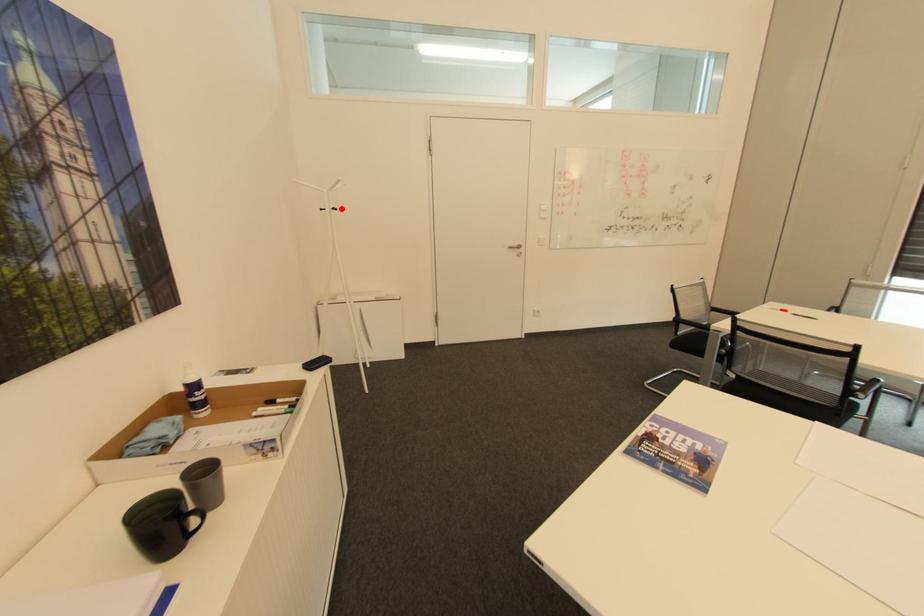
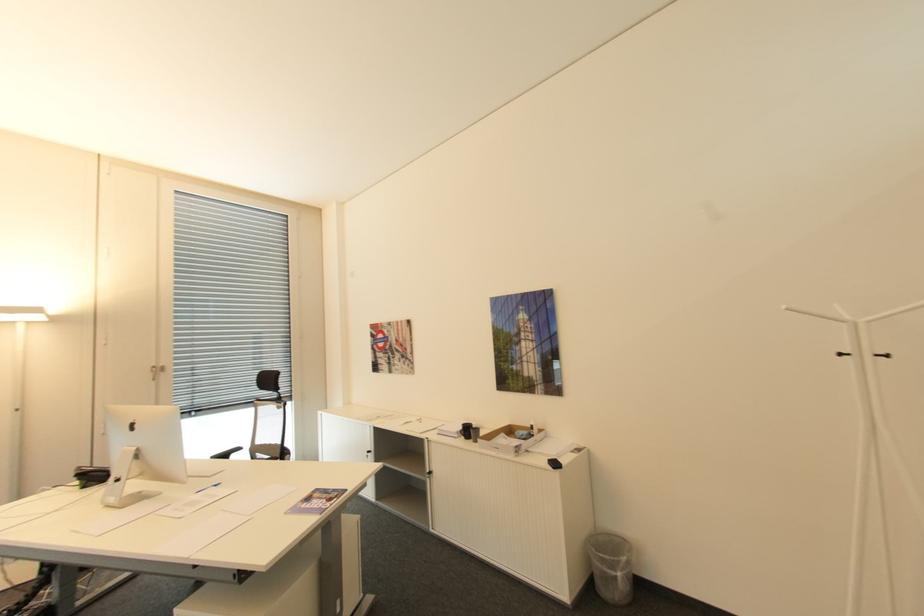
Locate, in the second image, the point that corresponds to the highlighted location in the first image.

(894, 355)